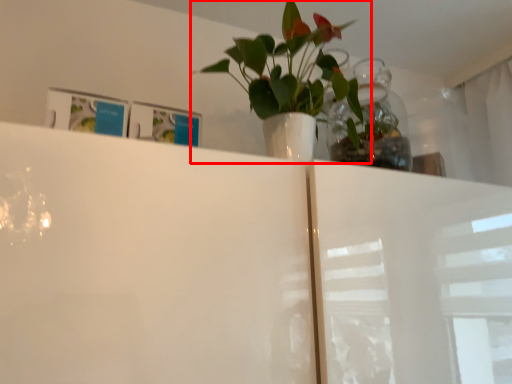
Question: Where is houseplant (annotated by the red box) located in relation to glass vase in the image?

Choices:
 (A) left
 (B) right

Answer: (A)